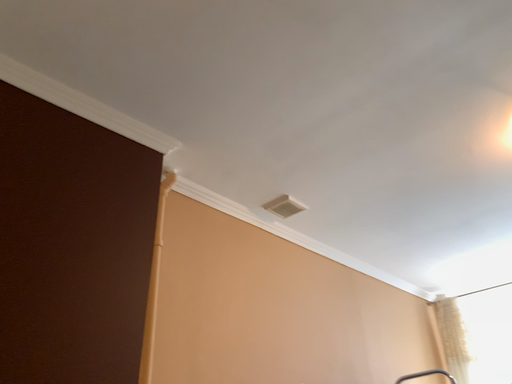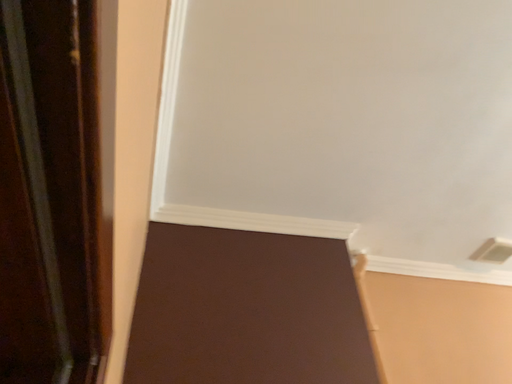
Question: How did the camera likely rotate when shooting the video?

Choices:
 (A) rotated right
 (B) rotated left

Answer: (B)